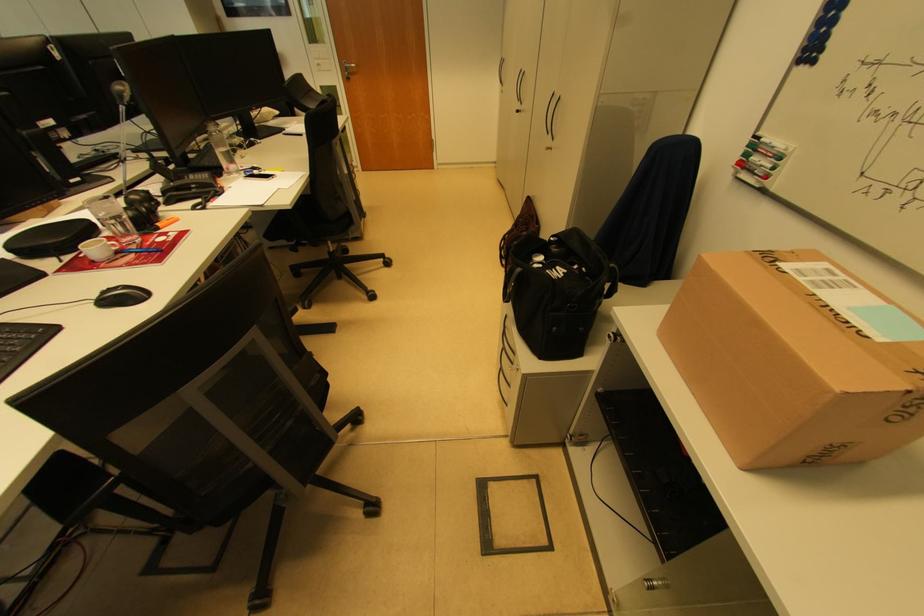
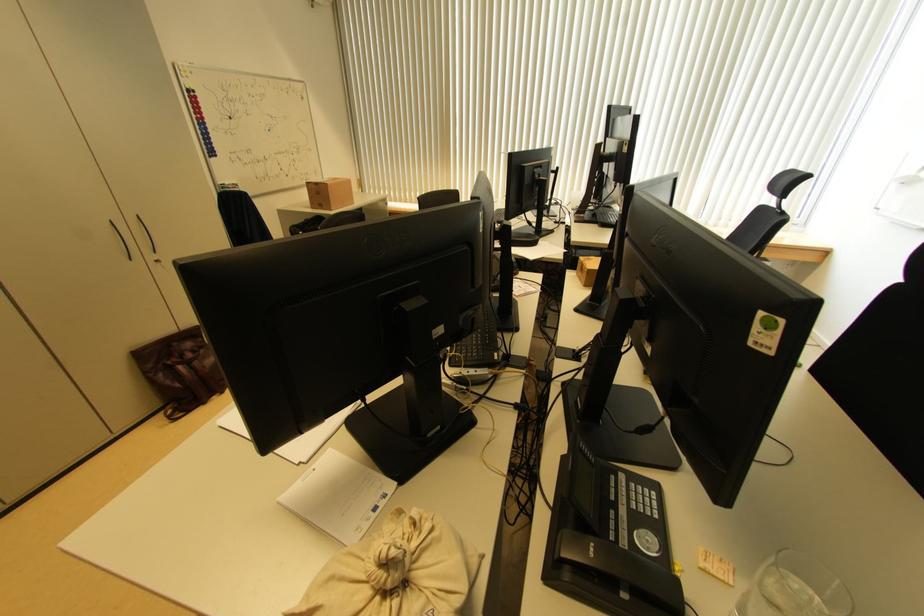
Question: I am providing you with two images of the same scene from different viewpoints. After the viewpoint changes to image2, which objects are now occluded?

Choices:
 (A) clear drinking glass
 (B) cardboard box
 (C) keyboard key
 (D) silver case handle

Answer: (A)